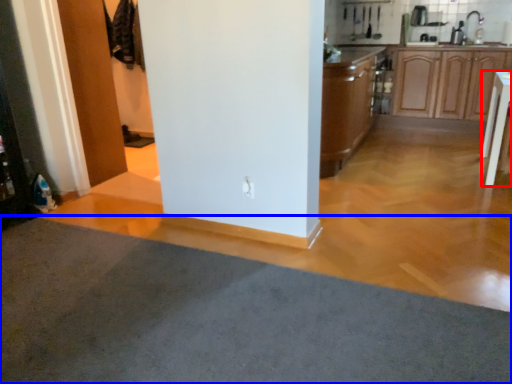
Question: Which of the following is the closest to the observer, table (highlighted by a red box) or plain (highlighted by a blue box)?

Choices:
 (A) table
 (B) plain

Answer: (B)